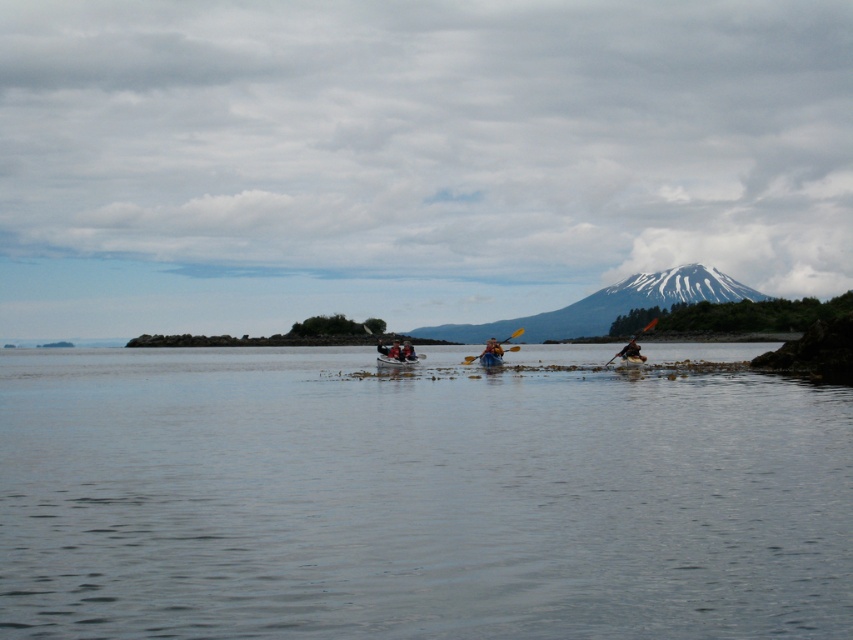
In the scene shown: You are standing on the shore and see the yellow plastic kayak at center and the blue plastic canoe at center. Which one is positioned to the left?

The yellow plastic kayak at center is positioned to the left of the blue plastic canoe at center.

You are a photographer trying to capture the kayakers. You notice the wooden paddle at right and the dark brown leather jacket at lower right. Which object is wider in the image?

The wooden paddle at right is wider than the dark brown leather jacket at lower right according to the description.

You are standing at the camera position and want to reach point (527, 317). Is the distance more than 600 feet?

Yes, the distance between the camera and point (527, 317) is 644.35 feet, which is more than 600 feet.